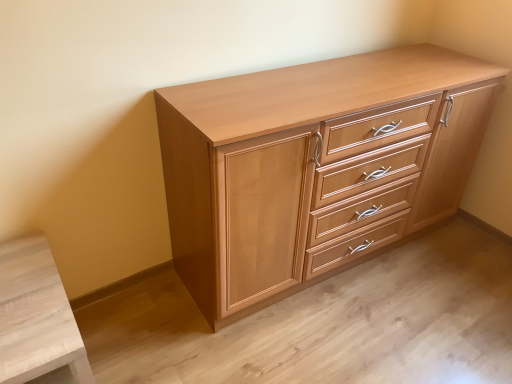
Question: Should I look upward or downward to see light brown wood chest of drawers at center?

Choices:
 (A) up
 (B) down

Answer: (A)

Question: Is light brown wood chest of drawers at center taller than light wood cabinet at lower left?

Choices:
 (A) no
 (B) yes

Answer: (B)

Question: From a real-world perspective, is light brown wood chest of drawers at center physically below light wood cabinet at lower left?

Choices:
 (A) yes
 (B) no

Answer: (B)

Question: Does light brown wood chest of drawers at center appear on the right side of light wood cabinet at lower left?

Choices:
 (A) yes
 (B) no

Answer: (A)

Question: Considering the relative sizes of light brown wood chest of drawers at center and light wood cabinet at lower left in the image provided, is light brown wood chest of drawers at center shorter than light wood cabinet at lower left?

Choices:
 (A) yes
 (B) no

Answer: (B)

Question: Is light brown wood chest of drawers at center looking in the opposite direction of light wood cabinet at lower left?

Choices:
 (A) no
 (B) yes

Answer: (A)

Question: Is light brown wood chest of drawers at center thinner than light wood cabinet at lower left?

Choices:
 (A) yes
 (B) no

Answer: (A)

Question: From the image's perspective, is light wood cabinet at lower left under light brown wood chest of drawers at center?

Choices:
 (A) no
 (B) yes

Answer: (B)

Question: From a real-world perspective, does light wood cabinet at lower left sit lower than light brown wood chest of drawers at center?

Choices:
 (A) yes
 (B) no

Answer: (A)

Question: Does light wood cabinet at lower left come behind light brown wood chest of drawers at center?

Choices:
 (A) no
 (B) yes

Answer: (A)

Question: Is light wood cabinet at lower left thinner than light brown wood chest of drawers at center?

Choices:
 (A) no
 (B) yes

Answer: (A)

Question: Can you confirm if light wood cabinet at lower left is bigger than light brown wood chest of drawers at center?

Choices:
 (A) no
 (B) yes

Answer: (A)

Question: Does light wood cabinet at lower left have a greater height compared to light brown wood chest of drawers at center?

Choices:
 (A) no
 (B) yes

Answer: (A)

Question: Is light brown wood chest of drawers at center inside the boundaries of light wood cabinet at lower left, or outside?

Choices:
 (A) inside
 (B) outside

Answer: (B)